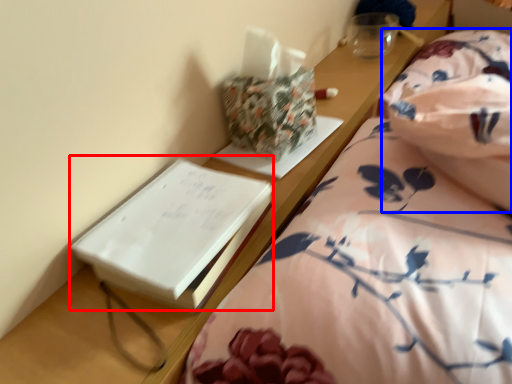
Question: Which object appears farthest to the camera in this image, paperback book (highlighted by a red box) or blanket (highlighted by a blue box)?

Choices:
 (A) paperback book
 (B) blanket

Answer: (B)